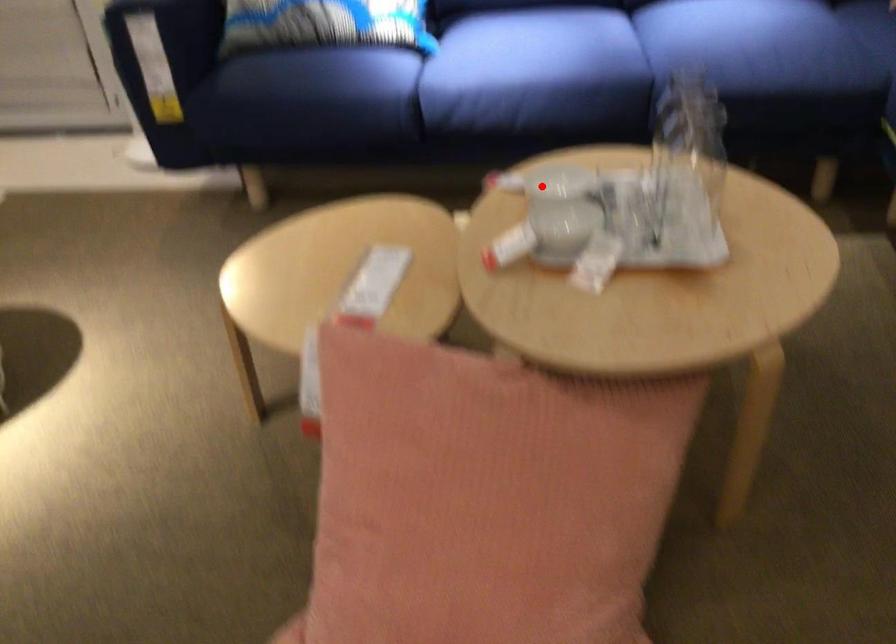
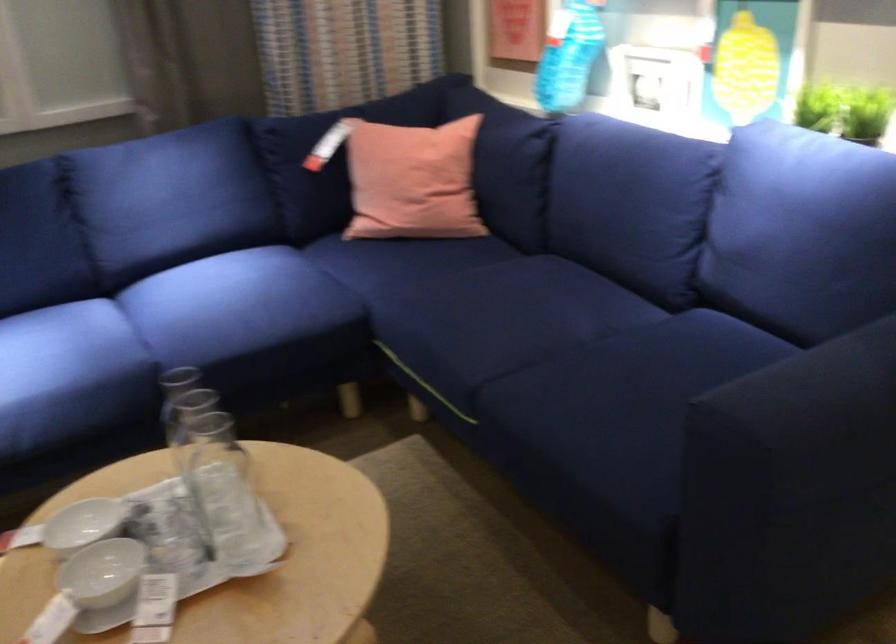
Where in the second image is the point corresponding to the highlighted location from the first image?

(83, 524)